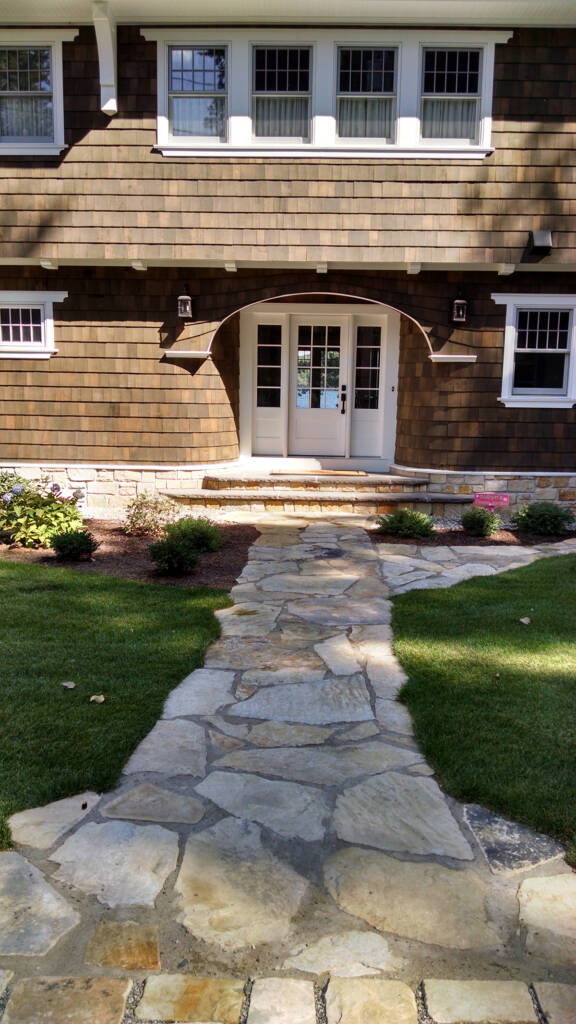
You are a GUI agent. You are given a task and a screenshot of the screen. Output one action in this format:
    pyautogui.click(x=<x>, y=<y>)
    Task: Click on the lights
    
    Given the screenshot: What is the action you would take?
    pyautogui.click(x=456, y=307), pyautogui.click(x=181, y=302)